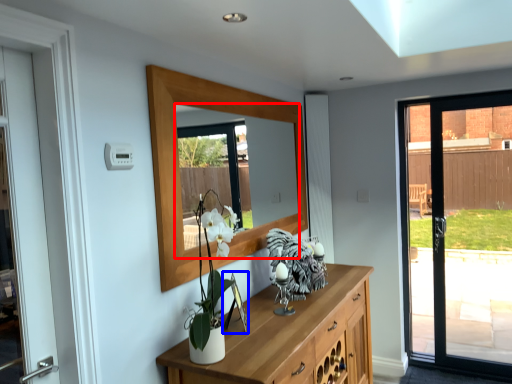
Question: Among these objects, which one is nearest to the camera, mirror (highlighted by a red box) or picture frame (highlighted by a blue box)?

Choices:
 (A) mirror
 (B) picture frame

Answer: (A)